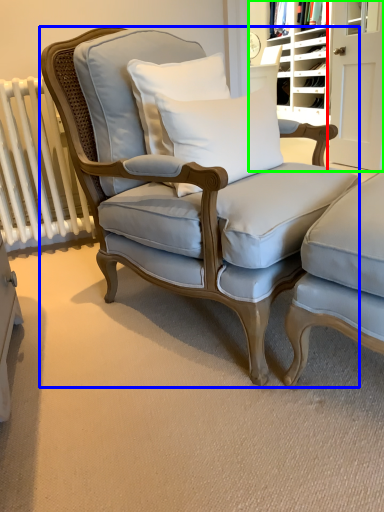
Question: Which object is positioned farthest from door (highlighted by a red box)? Select from chair (highlighted by a blue box) and bookshelf (highlighted by a green box).

Choices:
 (A) chair
 (B) bookshelf

Answer: (A)